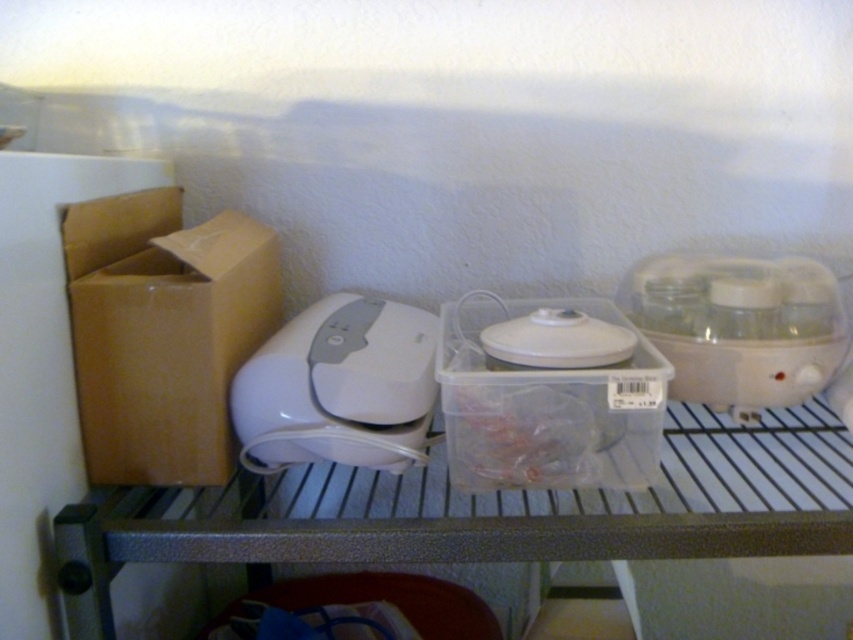
You are organizing items on a metal shelf in a kitchen. You have a brown cardboard box at left and a transparent plastic container at center. Which item is closer to you when standing in front of the shelf?

The brown cardboard box at left is closer to you because it is further to the viewer than the transparent plastic container at center, meaning it is positioned nearer in the scene.

You are organizing the kitchen shelf and need to place a new item between the white plastic appliance at center and the white plastic food processor at right. Is there space between them for a 10 cm wide item?

The white plastic appliance at center is to the left of white plastic food processor at right, so there is space between them. Since the question does not specify the distance between them, but the objects are positioned next to each other, it is possible that a 10 cm wide item could fit depending on the actual spacing. However, without exact measurements, we cannot confirm for certain.

You are organizing items on a metal shelf and need to place the brown cardboard box at left and the white plastic food processor at right. If the shelf has a width limit of 50 cm, and the food processor takes up 30 cm, can both items fit side by side?

The brown cardboard box at left is narrower than the white plastic food processor at right, which takes up 30 cm. Since the total width required would be less than 30 cm plus the box, but the exact width of the box isn